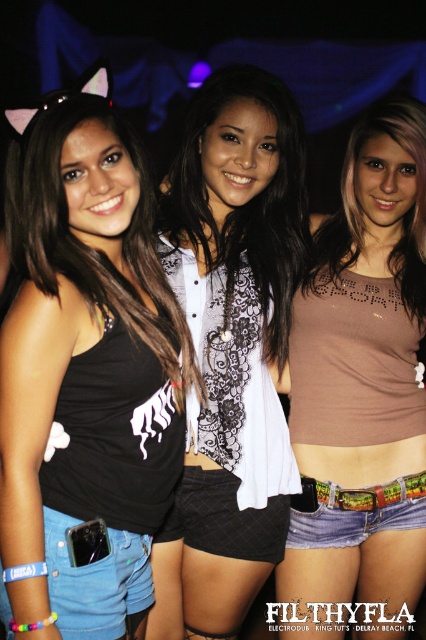
Is white lace shirt at center thinner than brown matte tank top at center?

In fact, white lace shirt at center might be wider than brown matte tank top at center.

Locate an element on the screen. white lace shirt at center is located at coordinates (232, 346).

You are a GUI agent. You are given a task and a screenshot of the screen. Output one action in this format:
    pyautogui.click(x=<x>, y=<y>)
    Task: Click on the white lace shirt at center
    
    Given the screenshot: What is the action you would take?
    pyautogui.click(x=232, y=346)

Does denim shorts at lower left appear on the right side of black mesh shorts at center?

Incorrect, denim shorts at lower left is not on the right side of black mesh shorts at center.

Can you confirm if denim shorts at lower left is positioned below black mesh shorts at center?

Indeed, denim shorts at lower left is positioned under black mesh shorts at center.

The width and height of the screenshot is (426, 640). Describe the element at coordinates (95, 580) in the screenshot. I see `denim shorts at lower left` at that location.

At what (x,y) coordinates should I click in order to perform the action: click on denim shorts at lower left. Please return your answer as a coordinate pair (x, y). Looking at the image, I should click on (95, 580).

Is black matte tank top at left smaller than multicolored printed fabric at lower center?

Actually, black matte tank top at left might be larger than multicolored printed fabric at lower center.

Does black matte tank top at left lie behind multicolored printed fabric at lower center?

No, it is not.

Is point (19, 593) farther from viewer compared to point (377, 504)?

No, (19, 593) is closer to viewer.

The image size is (426, 640). Identify the location of black matte tank top at left. (86, 333).